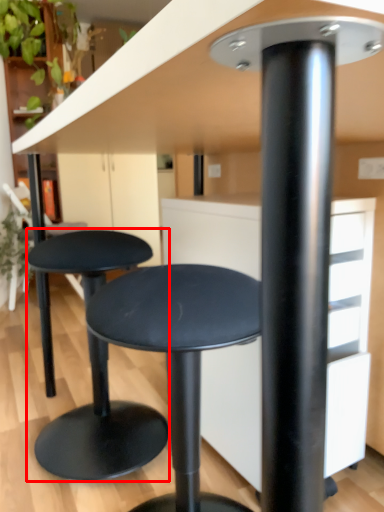
Question: Observing the image, what is the correct spatial positioning of stool (annotated by the red box) in reference to stool?

Choices:
 (A) left
 (B) right

Answer: (A)